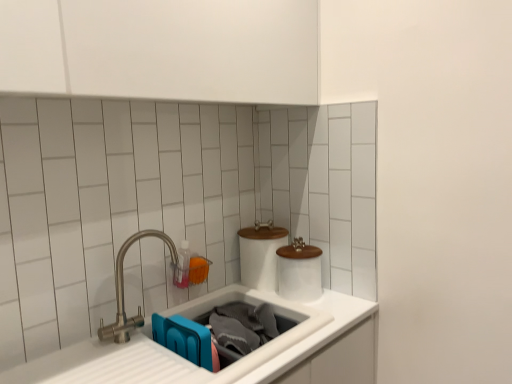
This screenshot has width=512, height=384. Describe the element at coordinates (270, 342) in the screenshot. I see `white matte sink at lower center, marked as the first sink in a right-to-left arrangement` at that location.

I want to click on brushed metal faucet at left, so click(x=123, y=290).

Locate an element on the screen. The width and height of the screenshot is (512, 384). white ceramic toilet paper at center, which is the first toilet paper in left-to-right order is located at coordinates (260, 255).

The image size is (512, 384). What do you see at coordinates (211, 341) in the screenshot?
I see `white glossy sink at lower left, which is the 1th sink in left-to-right order` at bounding box center [211, 341].

At what (x,y) coordinates should I click in order to perform the action: click on white matte sink at lower center, the second sink positioned from the left. Please return your answer as a coordinate pair (x, y). The image size is (512, 384). Looking at the image, I should click on (270, 342).

Considering the positions of objects translucent plastic bottle at sink and brushed metal faucet at left in the image provided, who is in front, translucent plastic bottle at sink or brushed metal faucet at left?

brushed metal faucet at left is closer to the camera.

How many degrees apart are the facing directions of translucent plastic bottle at sink and brushed metal faucet at left?

They differ by 1.14 degrees in their facing directions.

From the image's perspective, which one is positioned lower, translucent plastic bottle at sink or brushed metal faucet at left?

brushed metal faucet at left appears lower in the image.

Is translucent plastic bottle at sink oriented away from brushed metal faucet at left?

translucent plastic bottle at sink is not turned away from brushed metal faucet at left.

Considering the relative sizes of brushed metal faucet at left and translucent plastic bottle at sink in the image provided, is brushed metal faucet at left shorter than translucent plastic bottle at sink?

No.

From the image's perspective, is brushed metal faucet at left located above or below translucent plastic bottle at sink?

Based on their image positions, brushed metal faucet at left is located beneath translucent plastic bottle at sink.

Considering the relative positions of brushed metal faucet at left and translucent plastic bottle at sink in the image provided, is brushed metal faucet at left to the right of translucent plastic bottle at sink from the viewer's perspective?

In fact, brushed metal faucet at left is to the left of translucent plastic bottle at sink.

Is brushed metal faucet at left facing away from translucent plastic bottle at sink?

No, brushed metal faucet at left is not facing away from translucent plastic bottle at sink.

Where is `sink that is the 2nd object directly below the white glossy toilet paper at center, which is the 2th toilet paper in left-to-right order (from a real-world perspective)`? This screenshot has width=512, height=384. sink that is the 2nd object directly below the white glossy toilet paper at center, which is the 2th toilet paper in left-to-right order (from a real-world perspective) is located at coordinates (270, 342).

Considering the positions of objects white matte sink at lower center, marked as the first sink in a right-to-left arrangement, and white glossy toilet paper at center, placed as the first toilet paper when sorted from right to left, in the image provided, who is more to the left, white matte sink at lower center, marked as the first sink in a right-to-left arrangement, or white glossy toilet paper at center, placed as the first toilet paper when sorted from right to left,?

From the viewer's perspective, white matte sink at lower center, marked as the first sink in a right-to-left arrangement, appears more on the left side.

From the image's perspective, is white matte sink at lower center, marked as the first sink in a right-to-left arrangement, located above white glossy toilet paper at center, placed as the first toilet paper when sorted from right to left?

No, from the image's perspective, white matte sink at lower center, marked as the first sink in a right-to-left arrangement, is not over white glossy toilet paper at center, placed as the first toilet paper when sorted from right to left.

Considering the relative sizes of white matte sink at lower center, marked as the first sink in a right-to-left arrangement, and white glossy toilet paper at center, which is the 2th toilet paper in left-to-right order, in the image provided, is white matte sink at lower center, marked as the first sink in a right-to-left arrangement, smaller than white glossy toilet paper at center, which is the 2th toilet paper in left-to-right order,?

No, white matte sink at lower center, marked as the first sink in a right-to-left arrangement, is not smaller than white glossy toilet paper at center, which is the 2th toilet paper in left-to-right order.

Considering the sizes of objects white matte sink at lower center, the second sink positioned from the left, and translucent plastic bottle at sink in the image provided, who is thinner, white matte sink at lower center, the second sink positioned from the left, or translucent plastic bottle at sink?

Thinner between the two is translucent plastic bottle at sink.

From the image's perspective, between white matte sink at lower center, marked as the first sink in a right-to-left arrangement, and translucent plastic bottle at sink, which one is located above?

From the image's view, translucent plastic bottle at sink is above.

Considering the sizes of objects white matte sink at lower center, the second sink positioned from the left, and translucent plastic bottle at sink in the image provided, who is shorter, white matte sink at lower center, the second sink positioned from the left, or translucent plastic bottle at sink?

Standing shorter between the two is white matte sink at lower center, the second sink positioned from the left.

You are a GUI agent. You are given a task and a screenshot of the screen. Output one action in this format:
    pyautogui.click(x=<x>, y=<y>)
    Task: Click on the toiletry above the white glossy sink at lower left, which is the 1th sink in left-to-right order (from the image's perspective)
    This screenshot has height=384, width=512.
    Given the screenshot: What is the action you would take?
    pyautogui.click(x=182, y=266)

Is translucent plastic bottle at sink inside white glossy sink at lower left, which is the 1th sink in left-to-right order?

No, white glossy sink at lower left, which is the 1th sink in left-to-right order, does not contain translucent plastic bottle at sink.

From a real-world perspective, is white glossy sink at lower left, placed as the 2th sink when sorted from right to left, positioned under translucent plastic bottle at sink based on gravity?

Yes.

Considering the sizes of objects white glossy sink at lower left, which is the 1th sink in left-to-right order, and translucent plastic bottle at sink in the image provided, who is thinner, white glossy sink at lower left, which is the 1th sink in left-to-right order, or translucent plastic bottle at sink?

Thinner between the two is translucent plastic bottle at sink.

From a real-world perspective, does translucent plastic bottle at sink stand above white glossy toilet paper at center, which is the 2th toilet paper in left-to-right order?

Yes, from a real-world perspective, translucent plastic bottle at sink is over white glossy toilet paper at center, which is the 2th toilet paper in left-to-right order

Is point (184, 264) less distant than point (315, 284)?

No.

Identify the location of toiletry positioned vertically above the white glossy toilet paper at center, placed as the first toilet paper when sorted from right to left (from a real-world perspective). This screenshot has height=384, width=512. point(182,266).

Does translucent plastic bottle at sink turn towards white glossy toilet paper at center, placed as the first toilet paper when sorted from right to left?

No, translucent plastic bottle at sink does not turn towards white glossy toilet paper at center, placed as the first toilet paper when sorted from right to left.

From a real-world perspective, is white ceramic toilet paper at center, the second toilet paper positioned from the right, on white glossy sink at lower left, which is the 1th sink in left-to-right order?

Yes, from a real-world perspective, white ceramic toilet paper at center, the second toilet paper positioned from the right, is on top of white glossy sink at lower left, which is the 1th sink in left-to-right order.

Are white ceramic toilet paper at center, the second toilet paper positioned from the right, and white glossy sink at lower left, which is the 1th sink in left-to-right order, making contact?

No, white ceramic toilet paper at center, the second toilet paper positioned from the right, is not beside white glossy sink at lower left, which is the 1th sink in left-to-right order.

From the image's perspective, between white ceramic toilet paper at center, which is the first toilet paper in left-to-right order, and white glossy sink at lower left, which is the 1th sink in left-to-right order, who is located below?

From the image's view, white glossy sink at lower left, which is the 1th sink in left-to-right order, is below.

At what (x,y) coordinates should I click in order to perform the action: click on toiletry that is on the right side of brushed metal faucet at left. Please return your answer as a coordinate pair (x, y). The image size is (512, 384). Looking at the image, I should click on (182, 266).

You are a GUI agent. You are given a task and a screenshot of the screen. Output one action in this format:
    pyautogui.click(x=<x>, y=<y>)
    Task: Click on the tap on the left of translucent plastic bottle at sink
    The width and height of the screenshot is (512, 384).
    Given the screenshot: What is the action you would take?
    [123, 290]

Looking at the image, which one is located further to white matte sink at lower center, marked as the first sink in a right-to-left arrangement, white glossy toilet paper at center, placed as the first toilet paper when sorted from right to left, or white ceramic toilet paper at center, which is the first toilet paper in left-to-right order?

The object further to white matte sink at lower center, marked as the first sink in a right-to-left arrangement, is white ceramic toilet paper at center, which is the first toilet paper in left-to-right order.

When comparing their distances from brushed metal faucet at left, does white matte sink at lower center, marked as the first sink in a right-to-left arrangement, or white glossy toilet paper at center, which is the 2th toilet paper in left-to-right order, seem further?

white glossy toilet paper at center, which is the 2th toilet paper in left-to-right order.

From the image, which object appears to be farther from translucent plastic bottle at sink, white glossy toilet paper at center, which is the 2th toilet paper in left-to-right order, or white ceramic toilet paper at center, the second toilet paper positioned from the right?

Among the two, white glossy toilet paper at center, which is the 2th toilet paper in left-to-right order, is located further to translucent plastic bottle at sink.

Which object lies nearer to the anchor point brushed metal faucet at left, white matte sink at lower center, marked as the first sink in a right-to-left arrangement, or white ceramic toilet paper at center, which is the first toilet paper in left-to-right order?

white matte sink at lower center, marked as the first sink in a right-to-left arrangement, is closer to brushed metal faucet at left.

Estimate the real-world distances between objects in this image. Which object is further from white matte sink at lower center, marked as the first sink in a right-to-left arrangement, brushed metal faucet at left or translucent plastic bottle at sink?

translucent plastic bottle at sink is further to white matte sink at lower center, marked as the first sink in a right-to-left arrangement.

Estimate the real-world distances between objects in this image. Which object is further from white ceramic toilet paper at center, which is the first toilet paper in left-to-right order, brushed metal faucet at left or white glossy sink at lower left, placed as the 2th sink when sorted from right to left?

The object further to white ceramic toilet paper at center, which is the first toilet paper in left-to-right order, is brushed metal faucet at left.

Estimate the real-world distances between objects in this image. Which object is further from white glossy toilet paper at center, which is the 2th toilet paper in left-to-right order, white matte sink at lower center, marked as the first sink in a right-to-left arrangement, or translucent plastic bottle at sink?

translucent plastic bottle at sink lies further to white glossy toilet paper at center, which is the 2th toilet paper in left-to-right order, than the other object.

Looking at the image, which one is located closer to translucent plastic bottle at sink, white glossy toilet paper at center, which is the 2th toilet paper in left-to-right order, or white glossy sink at lower left, placed as the 2th sink when sorted from right to left?

white glossy sink at lower left, placed as the 2th sink when sorted from right to left, is closer to translucent plastic bottle at sink.

Find the location of a particular element. This screenshot has height=384, width=512. tap located between white glossy sink at lower left, placed as the 2th sink when sorted from right to left, and white ceramic toilet paper at center, the second toilet paper positioned from the right, in the depth direction is located at coordinates (123, 290).

The image size is (512, 384). Identify the location of tap located between white glossy sink at lower left, placed as the 2th sink when sorted from right to left, and white matte sink at lower center, marked as the first sink in a right-to-left arrangement, in the depth direction. (123, 290).

Image resolution: width=512 pixels, height=384 pixels. I want to click on toilet paper between translucent plastic bottle at sink and white glossy toilet paper at center, placed as the first toilet paper when sorted from right to left, in the horizontal direction, so coord(260,255).

Image resolution: width=512 pixels, height=384 pixels. I want to click on tap between white glossy sink at lower left, placed as the 2th sink when sorted from right to left, and translucent plastic bottle at sink, along the z-axis, so click(123, 290).